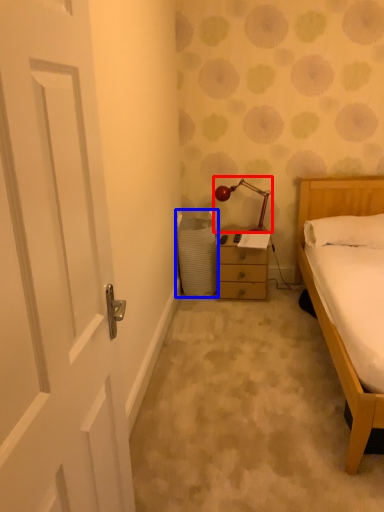
Question: Which object appears farthest to the camera in this image, lamp (highlighted by a red box) or laundry basket (highlighted by a blue box)?

Choices:
 (A) lamp
 (B) laundry basket

Answer: (A)